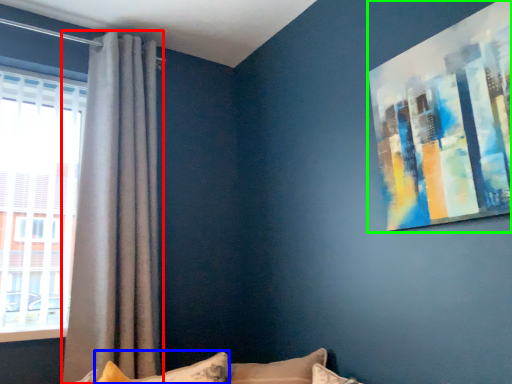
Question: Based on their relative distances, which object is nearer to curtain (highlighted by a red box)? Choose from pillow (highlighted by a blue box) and picture frame (highlighted by a green box).

Choices:
 (A) pillow
 (B) picture frame

Answer: (A)